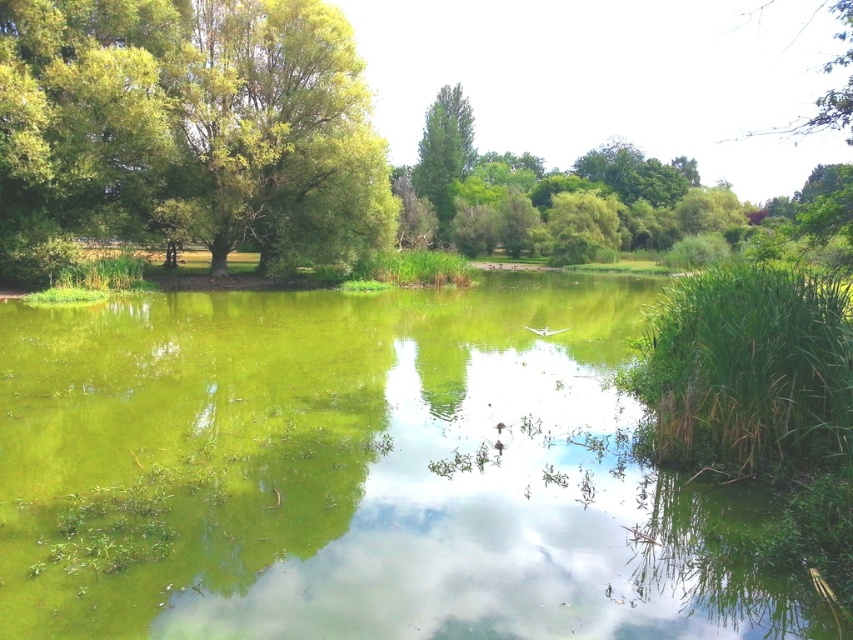
You are standing at the edge of the water in the serene natural scene. You notice two points marked in the image. Which point, point (109, 524) or point (7, 256), is closer to you?

Point (109, 524) is closer to you than point (7, 256).

What is the location of the point (x=187, y=129) in the image?

The point (x=187, y=129) is located on the green leafy tree at left.